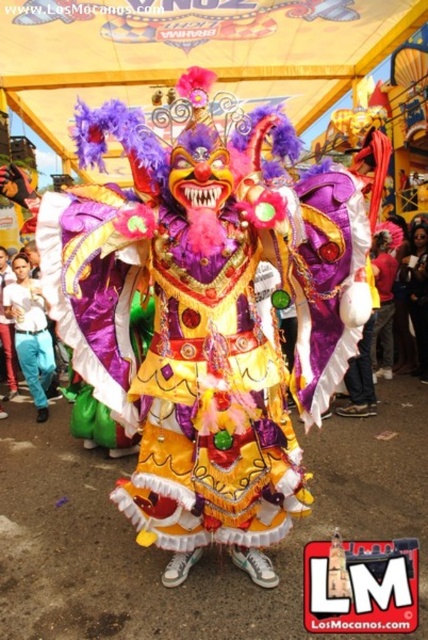
Question: Does white cotton shirt at lower left come behind matte purple costume at center?

Choices:
 (A) yes
 (B) no

Answer: (B)

Question: Can you confirm if white cotton shirt at lower left is positioned above matte purple costume at center?

Choices:
 (A) yes
 (B) no

Answer: (B)

Question: Among these objects, which one is farthest from the camera?

Choices:
 (A) matte purple costume at center
 (B) white cotton shirt at lower left

Answer: (A)

Question: Is white cotton shirt at lower left bigger than matte purple costume at center?

Choices:
 (A) no
 (B) yes

Answer: (A)

Question: Which of the following is the farthest from the observer?

Choices:
 (A) (374, 320)
 (B) (44, 316)

Answer: (A)